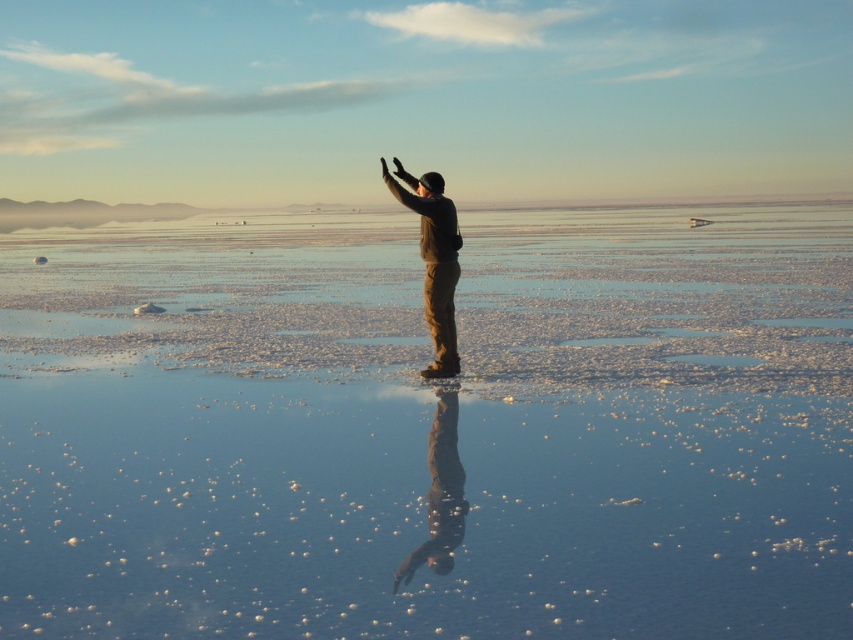
Question: Where is clear glass water at center located in relation to dark brown leather jacket at center in the image?

Choices:
 (A) left
 (B) right

Answer: (A)

Question: Does clear glass water at center appear over dark brown leather jacket at center?

Choices:
 (A) yes
 (B) no

Answer: (A)

Question: Considering the relative positions of clear glass water at center and dark brown leather jacket at center in the image provided, where is clear glass water at center located with respect to dark brown leather jacket at center?

Choices:
 (A) right
 (B) left

Answer: (B)